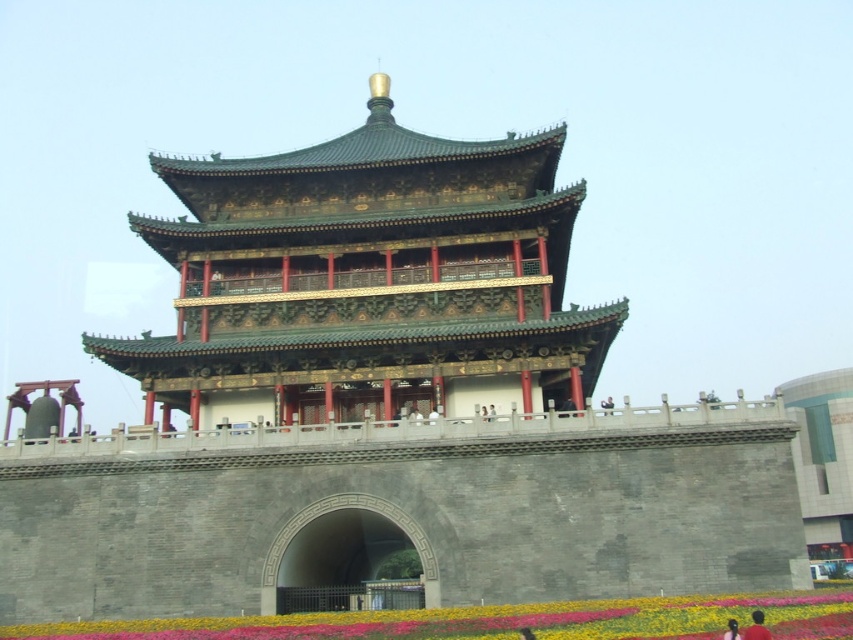
You are a visitor standing in front of the pagoda and want to take a photo of the dark brown hair at lower right. However, the vibrant floral carpet at lower center is blocking your view. Can you move to the left to avoid the carpet?

The vibrant floral carpet at lower center is much taller than the dark brown hair at lower right. Since the carpet is taller, it might block the view. Moving to the left could help if there is space, but the description does not provide information about the horizontal positioning or available space to the left.

You are standing in front of a traditional Chinese pagoda. There is a point marked at coordinates (367,280). What structure is located at this point?

The green glazed tile tower at center is located at point (367,280).

You are a visitor standing at the entrance of the pagoda and want to step onto the vibrant floral carpet at lower center. Can you walk directly to it without going around the green glazed tile tower at center?

The vibrant floral carpet at lower center is behind the green glazed tile tower at center, so you cannot walk directly to it without going around the green glazed tile tower at center.